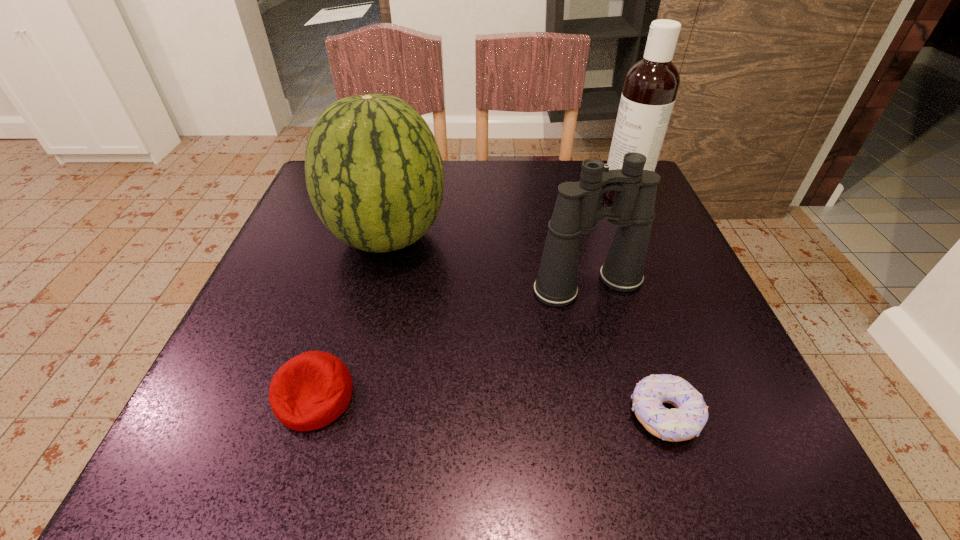
Where is `free space located on the seat area of the beanbag`? The height and width of the screenshot is (540, 960). free space located on the seat area of the beanbag is located at coordinates (293, 469).

The width and height of the screenshot is (960, 540). Identify the location of free space located 0.130m on the left of the doughnut. (538, 415).

The image size is (960, 540). In order to click on dishwasher detergent at the far edge in this screenshot , I will do `click(651, 85)`.

Locate an element on the screen. This screenshot has height=540, width=960. watermelon that is at the far edge is located at coordinates (374, 173).

This screenshot has width=960, height=540. In order to click on beanbag at the near edge in this screenshot , I will do `click(311, 390)`.

The width and height of the screenshot is (960, 540). I want to click on doughnut at the near edge, so click(x=685, y=421).

I want to click on watermelon located in the left edge section of the desktop, so click(374, 173).

This screenshot has height=540, width=960. I want to click on beanbag that is at the left edge, so click(x=311, y=390).

Where is `dishwasher detergent that is at the right edge`? dishwasher detergent that is at the right edge is located at coordinates (651, 85).

Identify the location of binoculars that is at the right edge. The height and width of the screenshot is (540, 960). (577, 210).